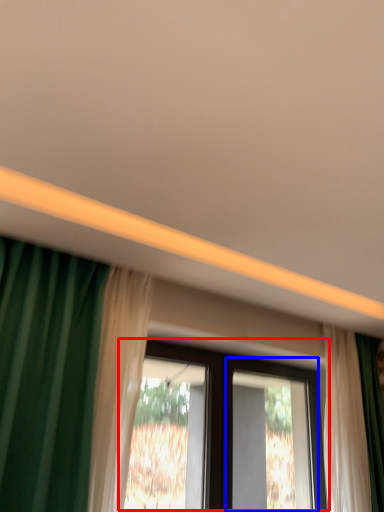
Question: Which object is further to the camera taking this photo, window (highlighted by a red box) or screen door (highlighted by a blue box)?

Choices:
 (A) window
 (B) screen door

Answer: (B)